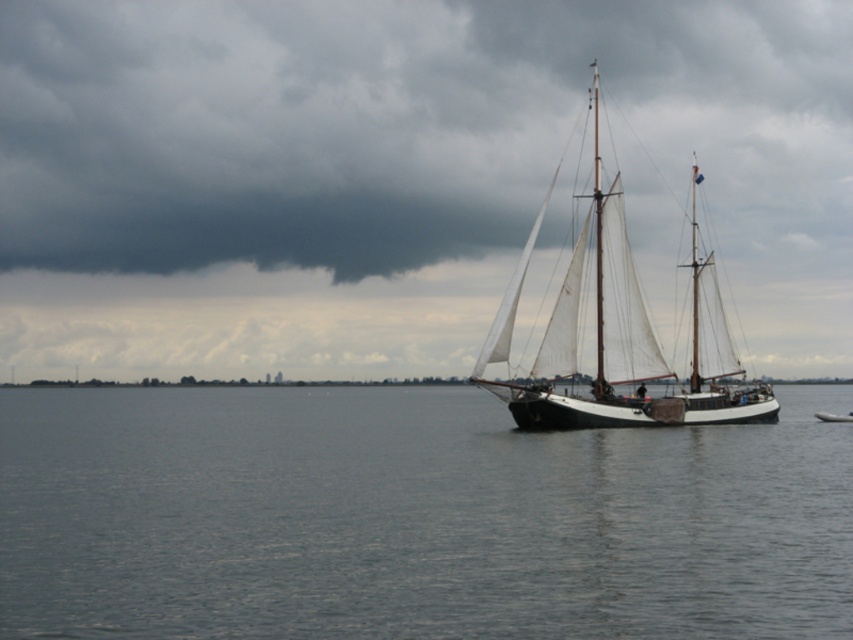
Which of these two, gray water at center or white plastic boat at center, stands taller?

Standing taller between the two is gray water at center.

Does gray water at center lie behind white plastic boat at center?

No, it is in front of white plastic boat at center.

Which is behind, point (322, 554) or point (828, 419)?

The point (828, 419) is more distant.

This screenshot has height=640, width=853. I want to click on gray water at center, so click(x=413, y=518).

Is point (496, 132) farther from camera compared to point (821, 417)?

Yes.

This screenshot has height=640, width=853. Describe the element at coordinates (396, 125) in the screenshot. I see `dark gray cloud at upper center` at that location.

The width and height of the screenshot is (853, 640). Identify the location of dark gray cloud at upper center. (396, 125).

Is dark gray cloud at upper center thinner than white canvas sailboat at center?

No, dark gray cloud at upper center is not thinner than white canvas sailboat at center.

Based on the photo, between dark gray cloud at upper center and white canvas sailboat at center, which one has more height?

dark gray cloud at upper center is taller.

In order to click on dark gray cloud at upper center in this screenshot , I will do `click(396, 125)`.